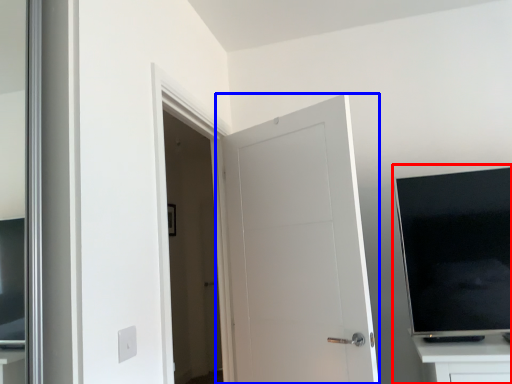
Question: Which of the following is the farthest to the observer, entertainment center (highlighted by a red box) or door (highlighted by a blue box)?

Choices:
 (A) entertainment center
 (B) door

Answer: (B)